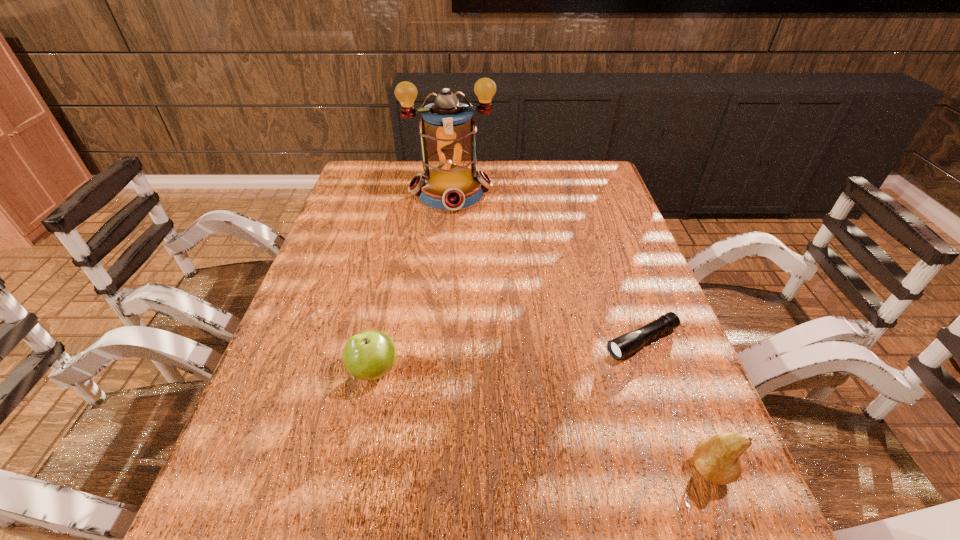
Identify the location of apple. The height and width of the screenshot is (540, 960). (368, 355).

The width and height of the screenshot is (960, 540). In order to click on pear in this screenshot , I will do `click(718, 458)`.

Locate an element on the screen. the farthest object is located at coordinates (447, 132).

Locate an element on the screen. The height and width of the screenshot is (540, 960). lantern is located at coordinates (447, 132).

This screenshot has height=540, width=960. I want to click on the shortest object, so click(x=624, y=345).

Where is `vacant space situated 0.360m on the back of the apple`? vacant space situated 0.360m on the back of the apple is located at coordinates (400, 249).

Find the location of `vacant position located on the left of the nearest object`. vacant position located on the left of the nearest object is located at coordinates (480, 470).

Where is `vacant position located 0.320m on the front-facing side of the farthest object`? The image size is (960, 540). vacant position located 0.320m on the front-facing side of the farthest object is located at coordinates (466, 284).

Find the location of a particular element. The width and height of the screenshot is (960, 540). free space located 0.360m on the front-facing side of the farthest object is located at coordinates (468, 294).

Where is `free space located on the front-facing side of the farthest object`? free space located on the front-facing side of the farthest object is located at coordinates (461, 253).